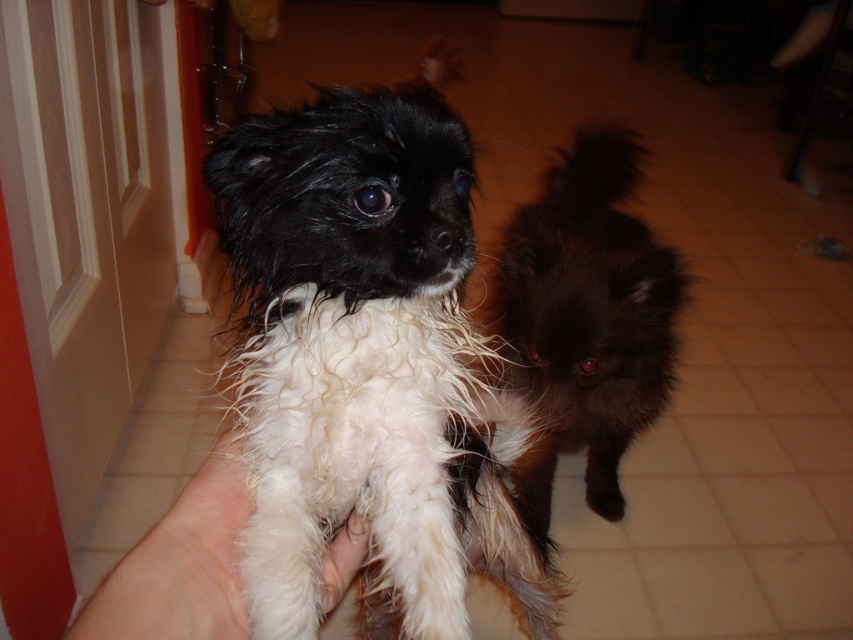
Is white fluffy dog at center to the left of white soft hand at center from the viewer's perspective?

Incorrect, white fluffy dog at center is not on the left side of white soft hand at center.

Is point (253, 220) in front of point (184, 486)?

That is True.

You are a GUI agent. You are given a task and a screenshot of the screen. Output one action in this format:
    pyautogui.click(x=<x>, y=<y>)
    Task: Click on the white fluffy dog at center
    
    Given the screenshot: What is the action you would take?
    pyautogui.click(x=368, y=368)

Is white fluffy dog at center bigger than shiny black fur at center?

Incorrect, white fluffy dog at center is not larger than shiny black fur at center.

Which is above, white fluffy dog at center or shiny black fur at center?

Positioned higher is shiny black fur at center.

Which is in front, point (412, 611) or point (607, 499)?

Point (412, 611) is in front.

At what (x,y) coordinates should I click in order to perform the action: click on white fluffy dog at center. Please return your answer as a coordinate pair (x, y). This screenshot has height=640, width=853. Looking at the image, I should click on (368, 368).

Where is `shiny black fur at center`? shiny black fur at center is located at coordinates (585, 317).

How far apart are shiny black fur at center and white soft hand at center?

shiny black fur at center is 3.44 feet away from white soft hand at center.

Which is behind, point (630, 317) or point (196, 586)?

The point (630, 317) is behind.

Find the location of a particular element. This screenshot has width=853, height=640. shiny black fur at center is located at coordinates point(585,317).